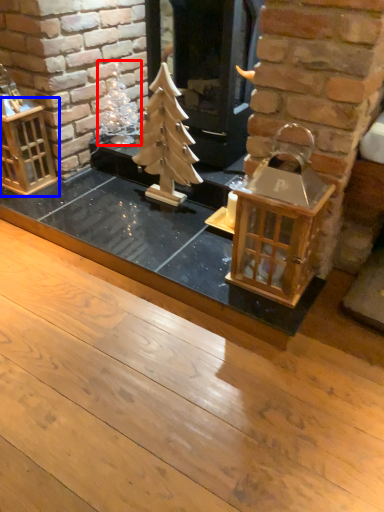
Question: Among these objects, which one is nearest to the camera, christmas decoration (highlighted by a red box) or cage (highlighted by a blue box)?

Choices:
 (A) christmas decoration
 (B) cage

Answer: (B)